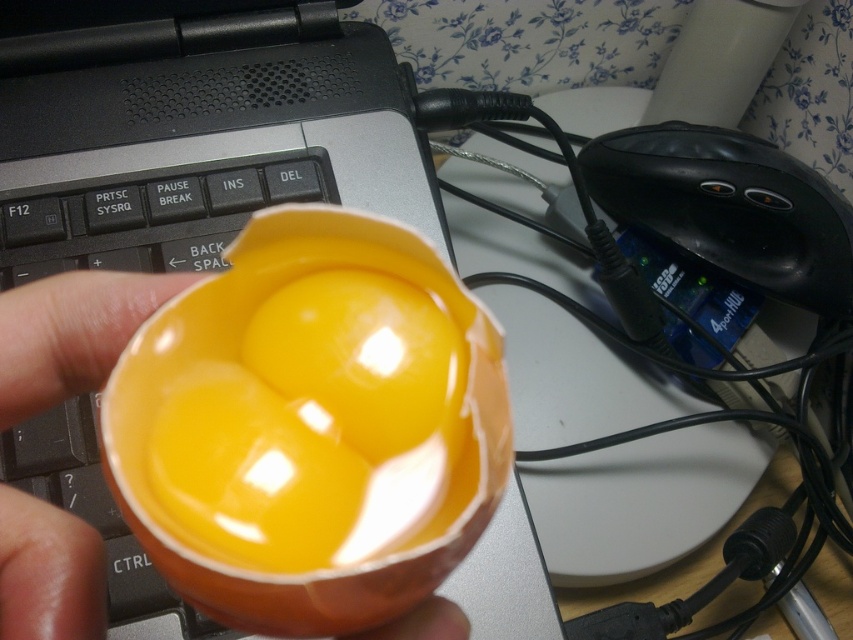
Which of these two, orange glossy egg at center or black matte keyboard at center, stands shorter?

With less height is black matte keyboard at center.

Does orange glossy egg at center have a greater height compared to black matte keyboard at center?

Correct, orange glossy egg at center is much taller as black matte keyboard at center.

The height and width of the screenshot is (640, 853). What are the coordinates of `orange glossy egg at center` in the screenshot? It's located at (311, 426).

Locate an element on the screen. orange glossy egg at center is located at coordinates (311, 426).